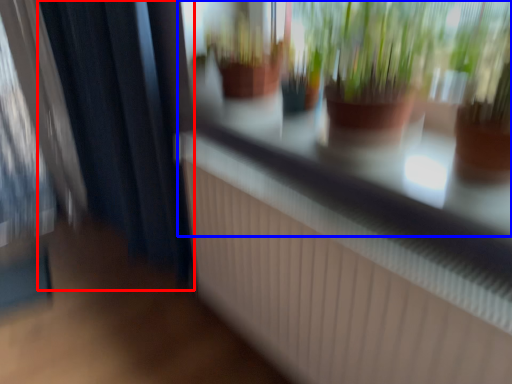
Question: Which object is closer to the camera taking this photo, curtain (highlighted by a red box) or shop window (highlighted by a blue box)?

Choices:
 (A) curtain
 (B) shop window

Answer: (B)